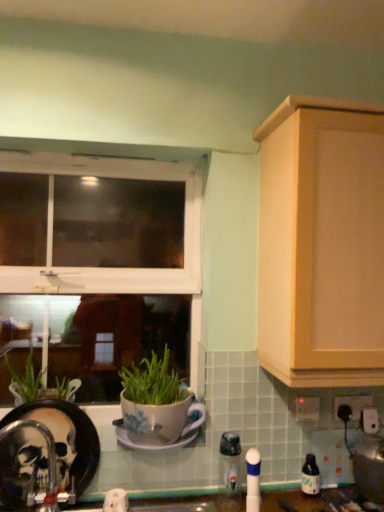
Question: Is metallic silver toaster at lower right, the 1th appliance when ordered from right to left, positioned with its back to white plastic electric outlet at upper right, the first electric outlet when ordered from left to right?

Choices:
 (A) no
 (B) yes

Answer: (A)

Question: Considering the relative sizes of metallic silver toaster at lower right, the 1th appliance when ordered from right to left, and white plastic electric outlet at upper right, arranged as the 2th electric outlet when viewed from the right, in the image provided, is metallic silver toaster at lower right, the 1th appliance when ordered from right to left, smaller than white plastic electric outlet at upper right, arranged as the 2th electric outlet when viewed from the right,?

Choices:
 (A) yes
 (B) no

Answer: (B)

Question: Is metallic silver toaster at lower right, the 1th appliance when ordered from right to left, in front of white plastic electric outlet at upper right, the first electric outlet when ordered from left to right?

Choices:
 (A) no
 (B) yes

Answer: (B)

Question: Is metallic silver toaster at lower right, the 1th appliance when ordered from right to left, oriented towards white plastic electric outlet at upper right, the first electric outlet when ordered from left to right?

Choices:
 (A) yes
 (B) no

Answer: (B)

Question: Is metallic silver toaster at lower right, placed as the 2th appliance when sorted from left to right, further to camera compared to white plastic electric outlet at upper right, the first electric outlet when ordered from left to right?

Choices:
 (A) yes
 (B) no

Answer: (B)

Question: From a real-world perspective, relative to light wood cabinet at upper right, is white plastic electric outlet at lower right, the 1th electric outlet when ordered from right to left, vertically above or below?

Choices:
 (A) below
 (B) above

Answer: (A)

Question: Looking at their shapes, would you say white plastic electric outlet at lower right, which is the 2th electric outlet in left-to-right order, is wider or thinner than light wood cabinet at upper right?

Choices:
 (A) thin
 (B) wide

Answer: (A)

Question: From the image's perspective, is white plastic electric outlet at lower right, which is the 2th electric outlet in left-to-right order, positioned above or below light wood cabinet at upper right?

Choices:
 (A) above
 (B) below

Answer: (B)

Question: In terms of size, does white plastic electric outlet at lower right, the 1th electric outlet when ordered from right to left, appear bigger or smaller than light wood cabinet at upper right?

Choices:
 (A) big
 (B) small

Answer: (B)

Question: Would you say white plastic electric outlet at upper right, arranged as the 2th electric outlet when viewed from the right, is to the left or to the right of green matte plant pot at left in the picture?

Choices:
 (A) left
 (B) right

Answer: (B)

Question: In terms of height, does white plastic electric outlet at upper right, the first electric outlet when ordered from left to right, look taller or shorter compared to green matte plant pot at left?

Choices:
 (A) short
 (B) tall

Answer: (A)

Question: From the image's perspective, is white plastic electric outlet at upper right, the first electric outlet when ordered from left to right, positioned above or below green matte plant pot at left?

Choices:
 (A) below
 (B) above

Answer: (A)

Question: In terms of size, does white plastic electric outlet at upper right, the first electric outlet when ordered from left to right, appear bigger or smaller than green matte plant pot at left?

Choices:
 (A) small
 (B) big

Answer: (A)

Question: Relative to white ceramic saucer at center, is white plastic window at upper left in front or behind?

Choices:
 (A) behind
 (B) front

Answer: (A)

Question: From the image's perspective, is white plastic window at upper left located above or below white ceramic saucer at center?

Choices:
 (A) above
 (B) below

Answer: (A)